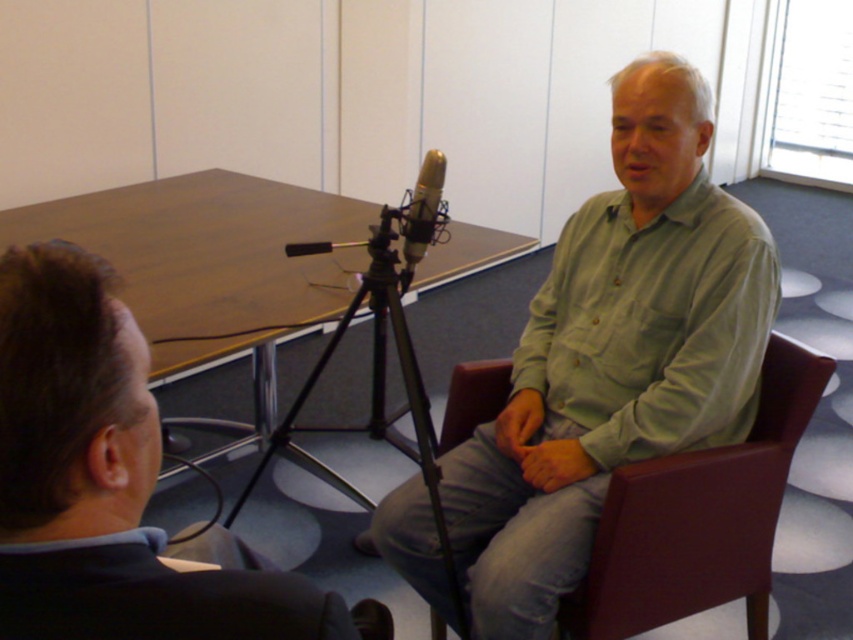
Question: Based on their relative distances, which object is farther from the dark gray suit at left?

Choices:
 (A) brown leather chair at right
 (B) silver metallic microphone at center
 (C) green matte shirt at center

Answer: (A)

Question: Is dark gray suit at left wider than black metal tripod at center?

Choices:
 (A) yes
 (B) no

Answer: (B)

Question: Based on their relative distances, which object is nearer to the wooden at center?

Choices:
 (A) black metal tripod at center
 (B) dark gray suit at left

Answer: (A)

Question: Is the position of dark gray suit at left more distant than that of brown leather chair at right?

Choices:
 (A) yes
 (B) no

Answer: (B)

Question: Which point appears closest to the camera in this image?

Choices:
 (A) (454, 584)
 (B) (268, 292)

Answer: (A)

Question: Is wooden at center further to camera compared to silver metallic microphone at center?

Choices:
 (A) no
 (B) yes

Answer: (B)